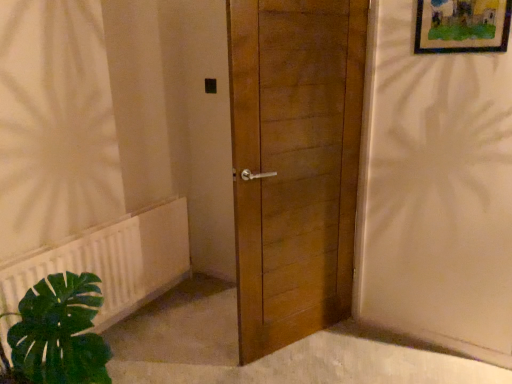
Question: Is wooden framed artwork at upper right inside white plastic radiator at lower left?

Choices:
 (A) no
 (B) yes

Answer: (A)

Question: From the image's perspective, is white plastic radiator at lower left located above wooden framed artwork at upper right?

Choices:
 (A) no
 (B) yes

Answer: (A)

Question: Is white plastic radiator at lower left facing towards wooden framed artwork at upper right?

Choices:
 (A) no
 (B) yes

Answer: (A)

Question: Considering the relative sizes of white plastic radiator at lower left and wooden framed artwork at upper right in the image provided, is white plastic radiator at lower left shorter than wooden framed artwork at upper right?

Choices:
 (A) yes
 (B) no

Answer: (B)

Question: From the image's perspective, does white plastic radiator at lower left appear lower than wooden framed artwork at upper right?

Choices:
 (A) yes
 (B) no

Answer: (A)

Question: Is white plastic radiator at lower left directly adjacent to wooden framed artwork at upper right?

Choices:
 (A) yes
 (B) no

Answer: (B)

Question: Can we say white plastic radiator at lower left lies outside wooden door at center?

Choices:
 (A) yes
 (B) no

Answer: (A)

Question: From the image's perspective, is white plastic radiator at lower left on top of wooden door at center?

Choices:
 (A) no
 (B) yes

Answer: (A)

Question: Is white plastic radiator at lower left placed right next to wooden door at center?

Choices:
 (A) no
 (B) yes

Answer: (A)

Question: Is white plastic radiator at lower left facing towards wooden door at center?

Choices:
 (A) no
 (B) yes

Answer: (B)

Question: Does white plastic radiator at lower left lie in front of wooden door at center?

Choices:
 (A) no
 (B) yes

Answer: (A)

Question: Can wooden door at center be found inside white plastic radiator at lower left?

Choices:
 (A) yes
 (B) no

Answer: (B)

Question: Can you confirm if wooden door at center is wider than white plastic radiator at lower left?

Choices:
 (A) no
 (B) yes

Answer: (B)